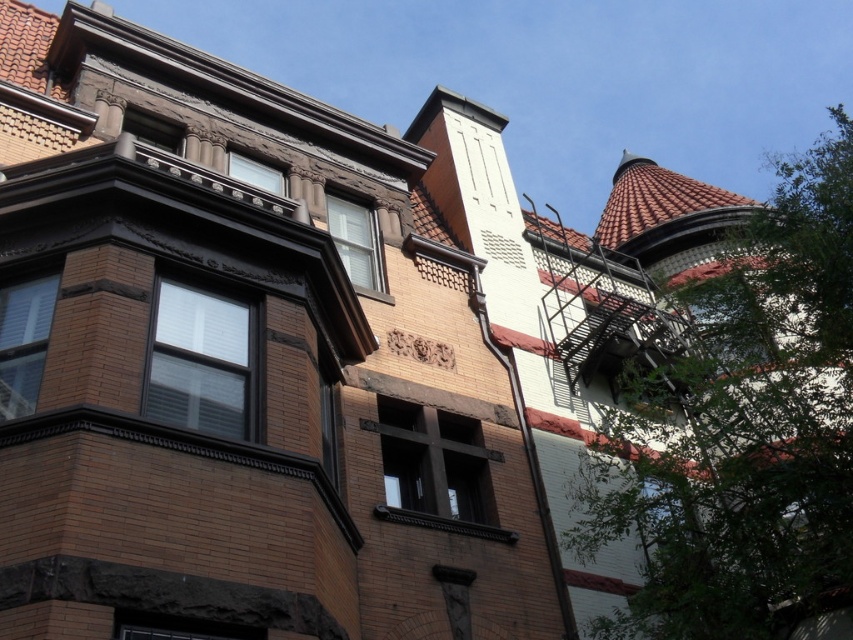
Question: Which point is farther to the camera?

Choices:
 (A) (177, 621)
 (B) (173, 128)

Answer: (B)

Question: Is matte glass window at upper center thinner than matte brown window at upper left?

Choices:
 (A) yes
 (B) no

Answer: (B)

Question: Which of the following is the farthest from the observer?

Choices:
 (A) (648, 545)
 (B) (251, 176)

Answer: (B)

Question: Does matte black window at center have a larger size compared to matte brown window at left?

Choices:
 (A) no
 (B) yes

Answer: (B)

Question: Which point is closer to the camera?

Choices:
 (A) matte glass window at upper center
 (B) transparent glass window at lower right
 (C) matte brown window at left
 (D) brown brick window at center

Answer: (D)

Question: Is matte black window at center thinner than matte brown window at lower center?

Choices:
 (A) no
 (B) yes

Answer: (A)